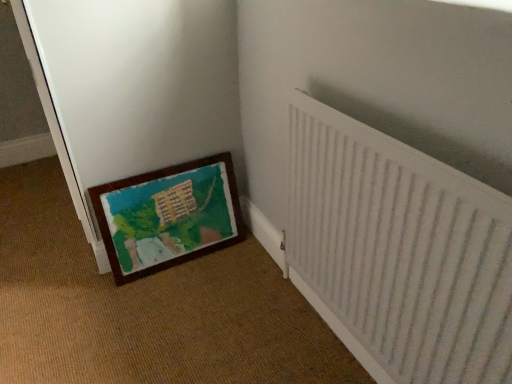
Question: Is wooden painted mat at lower left to the left or to the right of wooden picture frame at lower left in the image?

Choices:
 (A) right
 (B) left

Answer: (B)

Question: From the image's perspective, is wooden painted mat at lower left above or below wooden picture frame at lower left?

Choices:
 (A) below
 (B) above

Answer: (B)

Question: Considering the real-world distances, which object is closest to the wooden painted mat at lower left?

Choices:
 (A) white textured radiator at right
 (B) wooden picture frame at lower left

Answer: (B)

Question: Estimate the real-world distances between objects in this image. Which object is farther from the wooden picture frame at lower left?

Choices:
 (A) white textured radiator at right
 (B) wooden painted mat at lower left

Answer: (A)